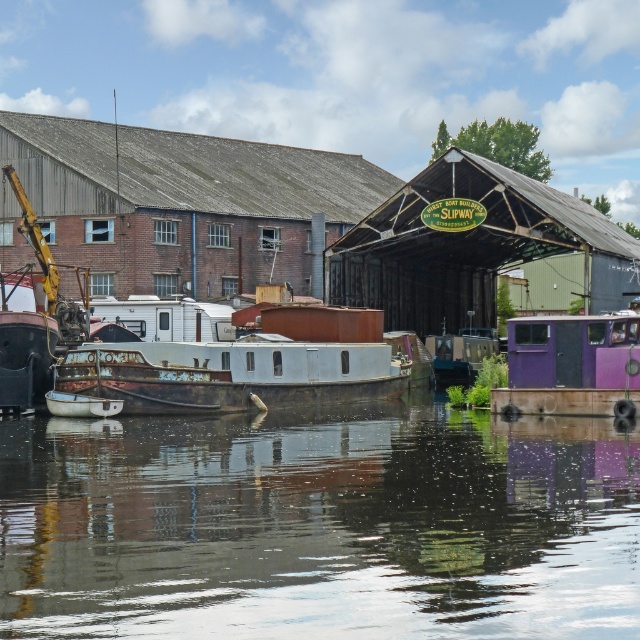
Question: Can you confirm if rusty metal boat at center is bigger than purple matte truck at lower right?

Choices:
 (A) no
 (B) yes

Answer: (B)

Question: Which of the following is the closest to the observer?

Choices:
 (A) (342, 372)
 (B) (588, 381)
 (C) (45, 432)

Answer: (B)

Question: Is glossy water at center smaller than purple matte truck at lower right?

Choices:
 (A) no
 (B) yes

Answer: (A)

Question: Based on their relative distances, which object is nearer to the rusty metal boat at center?

Choices:
 (A) purple matte truck at lower right
 (B) glossy water at center

Answer: (A)

Question: Can you confirm if rusty metal boat at center is positioned above purple matte truck at lower right?

Choices:
 (A) yes
 (B) no

Answer: (B)

Question: Which of the following is the farthest from the observer?

Choices:
 (A) (520, 394)
 (B) (545, 531)
 (C) (184, 396)

Answer: (C)